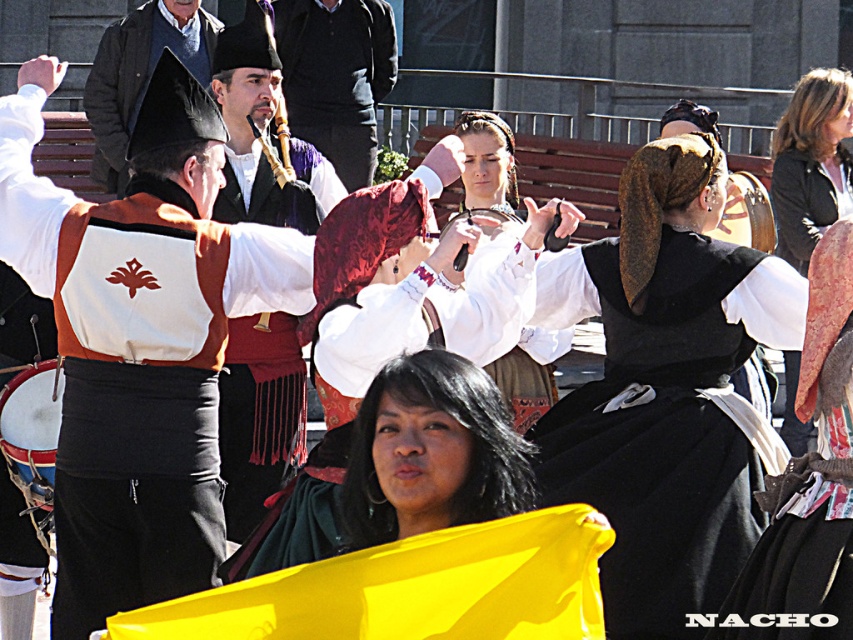
Between black velvet dress at center and black velvet shawl at lower center, which one is positioned lower?

Positioned lower is black velvet shawl at lower center.

Is point (688, 289) in front of point (320, 548)?

No, (688, 289) is further to viewer.

Is point (744, 349) positioned in front of point (335, 499)?

No, it is not.

Locate an element on the screen. black velvet dress at center is located at coordinates (660, 436).

Looking at this image, is matte black vest at center smaller than matte black hat at center?

No, matte black vest at center is not smaller than matte black hat at center.

Does matte black vest at center lie behind matte black hat at center?

That is False.

Does point (144, 387) come in front of point (294, 440)?

Yes, point (144, 387) is in front of point (294, 440).

You are a GUI agent. You are given a task and a screenshot of the screen. Output one action in this format:
    pyautogui.click(x=<x>, y=<y>)
    Task: Click on the matte black vest at center
    This screenshot has height=640, width=853.
    Given the screenshot: What is the action you would take?
    pyautogui.click(x=140, y=339)

Does black velvet shawl at lower center have a larger size compared to smooth purple vest at center?

Yes.

Does black velvet shawl at lower center appear under smooth purple vest at center?

Correct, black velvet shawl at lower center is located below smooth purple vest at center.

Where is `black velvet shawl at lower center`? black velvet shawl at lower center is located at coordinates (376, 474).

Where is `black velvet shawl at lower center`? black velvet shawl at lower center is located at coordinates (376, 474).